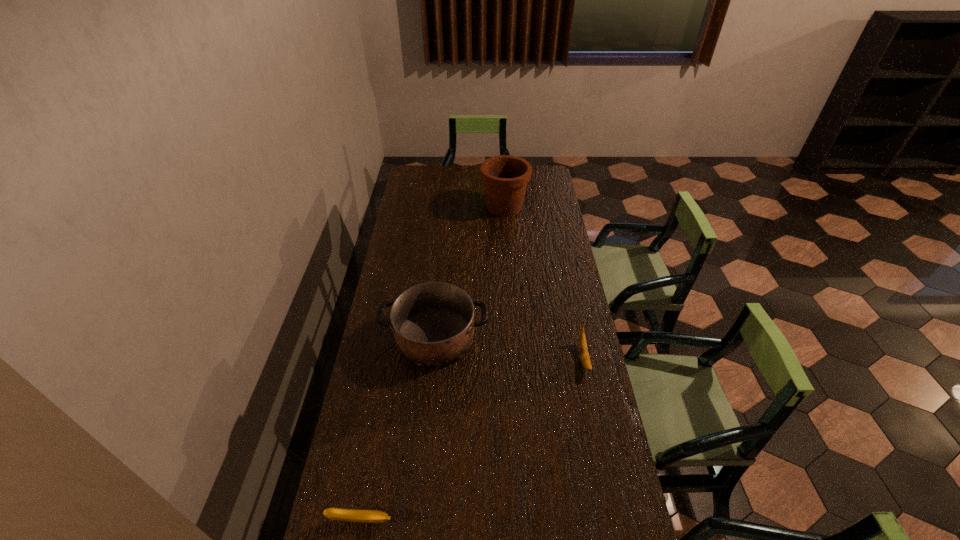
Find the location of `empty space that is in between the tallest object and the saucepan`. empty space that is in between the tallest object and the saucepan is located at coordinates (469, 272).

At what (x,y) coordinates should I click in order to perform the action: click on free space between the nearer banana and the farther banana. Please return your answer as a coordinate pair (x, y). This screenshot has height=540, width=960. Looking at the image, I should click on (472, 439).

In order to click on empty space that is in between the taller banana and the nearest object in this screenshot , I will do `click(472, 439)`.

At what (x,y) coordinates should I click in order to perform the action: click on vacant area between the farthest object and the saucepan. Please return your answer as a coordinate pair (x, y). Looking at the image, I should click on (469, 272).

Locate an element on the screen. free space between the third shortest object and the rightmost object is located at coordinates (509, 347).

Image resolution: width=960 pixels, height=540 pixels. What are the coordinates of `vacant area between the farther banana and the flowerpot` in the screenshot? It's located at (544, 282).

Identify which object is located as the third nearest to the farthest object. Please provide its 2D coordinates. Your answer should be formatted as a tuple, i.e. [(x, y)], where the tuple contains the x and y coordinates of a point satisfying the conditions above.

[(369, 516)]

The image size is (960, 540). Find the location of `object that ranks as the second closest to the rightmost object`. object that ranks as the second closest to the rightmost object is located at coordinates (369, 516).